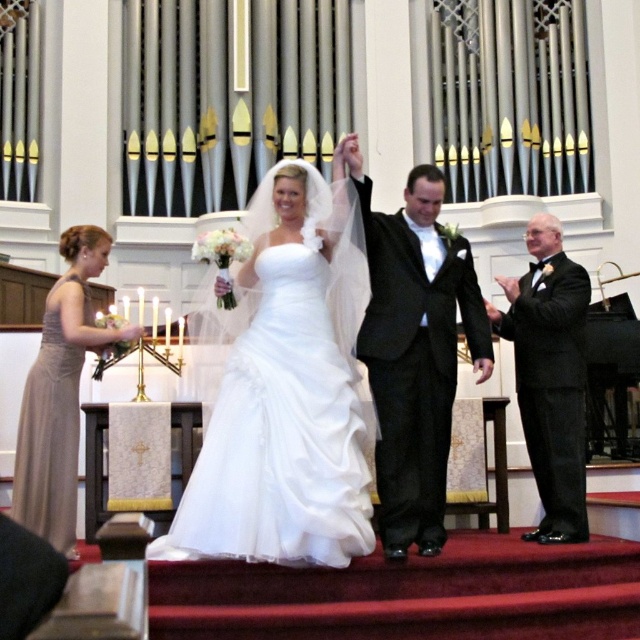
You are a photographer at the wedding and need to capture a full body shot of both the bride in the white satin dress at center and the bridesmaid in the satin beige dress at lower left. Considering their heights, which dress should be positioned closer to the camera to ensure both appear proportionally sized in the photo?

The white satin dress at center is taller than the satin beige dress at lower left. To ensure both appear proportionally sized in the photo, the shorter satin beige dress at lower left should be positioned closer to the camera.

You are a photographer positioned at the camera. You want to capture a closeup shot of the white satin dress at center. Given that your camera can focus on subjects within 10 meters, will you be able to take the photo?

The distance between the white satin dress at center and the camera is 9.33 meters, which is within the camera focus range of 10 meters. Therefore, you can take the photo.